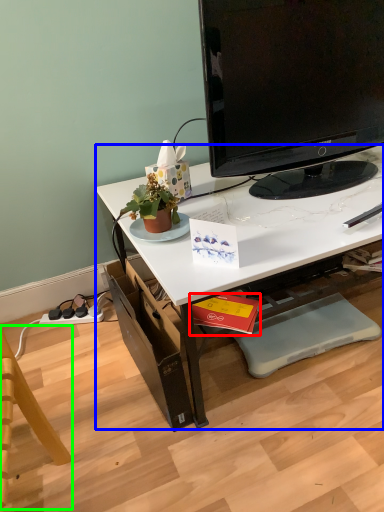
Question: Estimate the real-world distances between objects in this image. Which object is farther from book (highlighted by a red box), desk (highlighted by a blue box) or swivel chair (highlighted by a green box)?

Choices:
 (A) desk
 (B) swivel chair

Answer: (B)